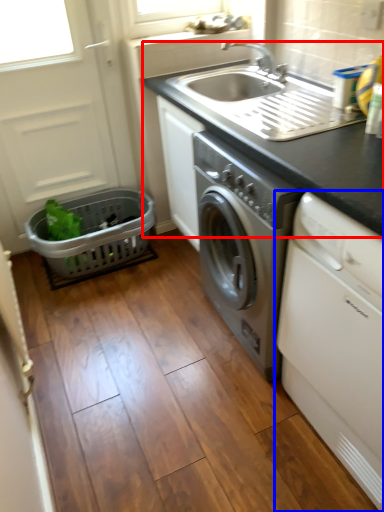
Question: Which object is further to the camera taking this photo, countertop (highlighted by a red box) or washing machine (highlighted by a blue box)?

Choices:
 (A) countertop
 (B) washing machine

Answer: (A)